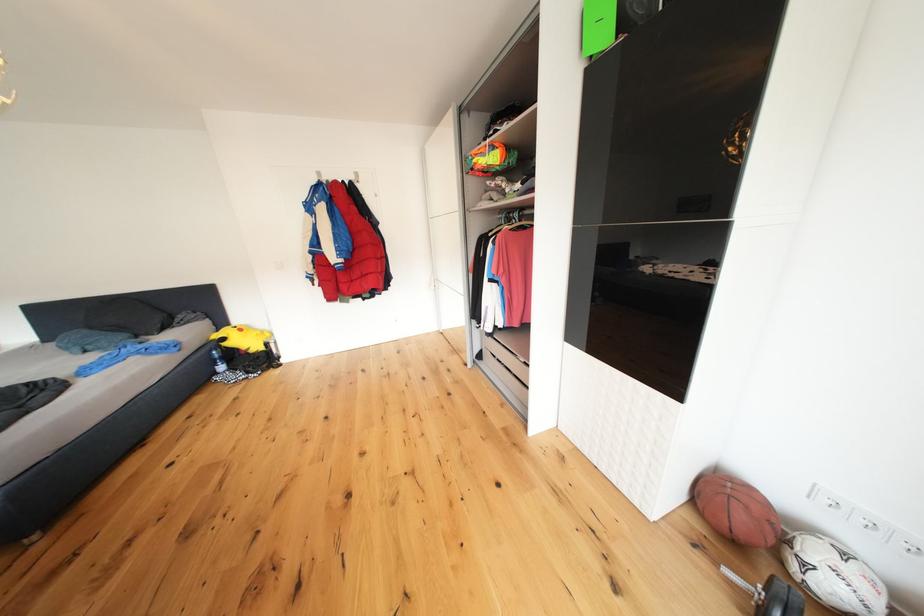
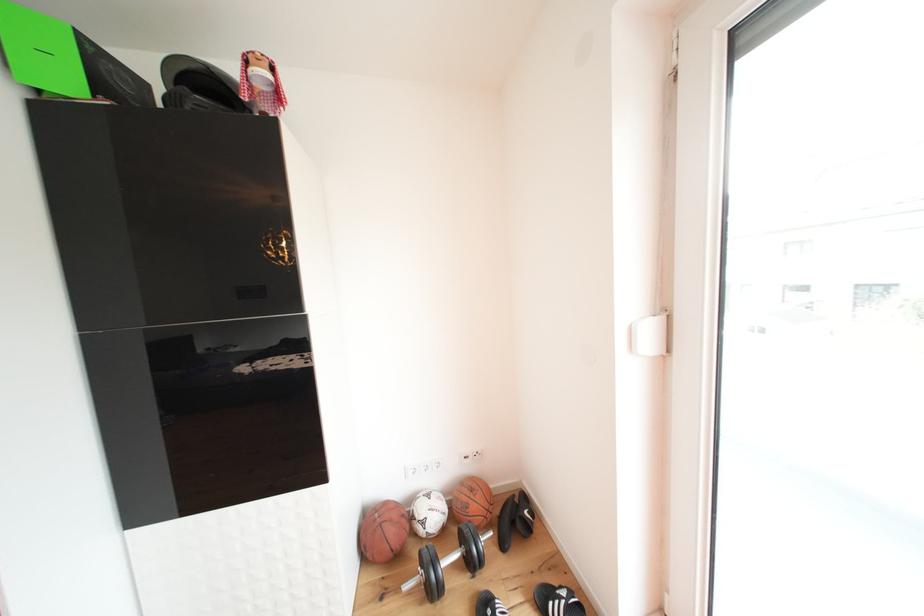
Find the pixel in the second image that matches [614,43] in the first image.

(76, 87)